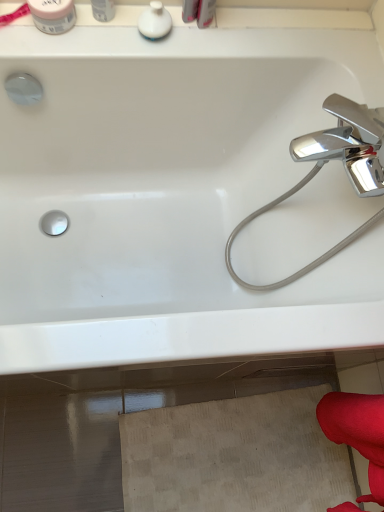
This screenshot has height=512, width=384. Find the location of `free spot to the left of white glossy soap dispenser at upper center, which ranks as the first toiletry in right-to-left order`. free spot to the left of white glossy soap dispenser at upper center, which ranks as the first toiletry in right-to-left order is located at coordinates (92, 39).